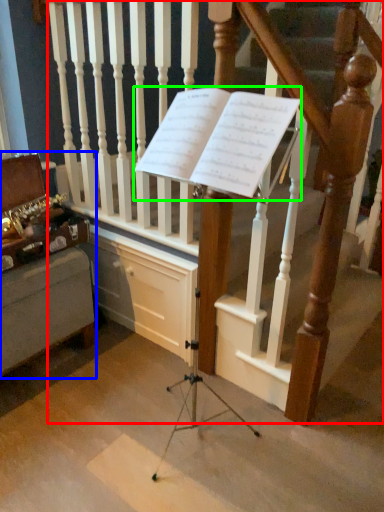
Question: Which object is the farthest from stairs (highlighted by a red box)? Choose among these: furniture (highlighted by a blue box) or sheet music (highlighted by a green box).

Choices:
 (A) furniture
 (B) sheet music

Answer: (A)